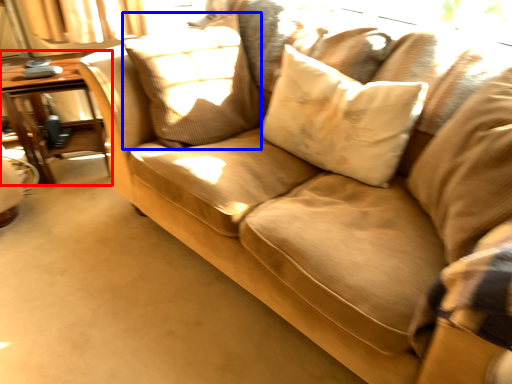
Question: Which point is further to the camera, table (highlighted by a red box) or pillow (highlighted by a blue box)?

Choices:
 (A) table
 (B) pillow

Answer: (A)